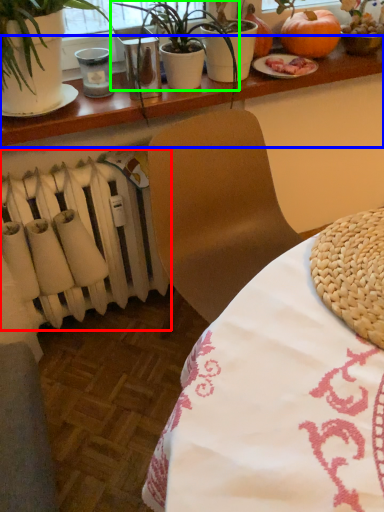
Question: Estimate the real-world distances between objects in this image. Which object is closer to radiator (highlighted by a red box), table (highlighted by a blue box) or houseplant (highlighted by a green box)?

Choices:
 (A) table
 (B) houseplant

Answer: (A)